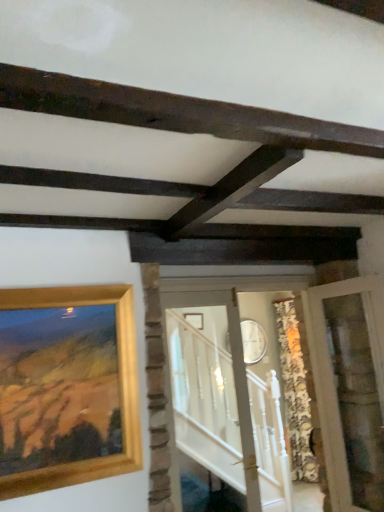
Where is `clear glass door at right, the second glass door from the left`? clear glass door at right, the second glass door from the left is located at coordinates (351, 388).

Where is `gold wooden picture frame at upper left`? gold wooden picture frame at upper left is located at coordinates (67, 387).

Is clear glass door at right, the second glass door from the left, surrounding dark brown wood at upper center?

No, dark brown wood at upper center is not a part of clear glass door at right, the second glass door from the left.

From a real-world perspective, which object stands above the other?

dark brown wood at upper center is physically above.

Looking at this image, which object is further away from the camera taking this photo, clear glass door at right, which is the first glass door from right to left, or dark brown wood at upper center?

clear glass door at right, which is the first glass door from right to left.

How many degrees apart are the facing directions of clear glass door at right, which is the first glass door from right to left, and dark brown wood at upper center?

The angular difference between clear glass door at right, which is the first glass door from right to left, and dark brown wood at upper center is 85.9 degrees.

Considering the relative positions of dark brown wood at upper center and clear glass door at right, which is the first glass door from right to left, in the image provided, is dark brown wood at upper center to the left of clear glass door at right, which is the first glass door from right to left, from the viewer's perspective?

Correct, you'll find dark brown wood at upper center to the left of clear glass door at right, which is the first glass door from right to left.

In the scene shown: From the image's perspective, which is above, dark brown wood at upper center or clear glass door at right, the second glass door from the left?

dark brown wood at upper center appears higher in the image.

Is clear glass door at right, the second glass door from the left, completely or partially inside dark brown wood at upper center?

That's incorrect, clear glass door at right, the second glass door from the left, is not inside dark brown wood at upper center.

From the image's perspective, is clear glass door at center, marked as the second glass door in a right-to-left arrangement, located beneath clear glass door at right, the second glass door from the left?

Yes, from the image's perspective, clear glass door at center, marked as the second glass door in a right-to-left arrangement, is below clear glass door at right, the second glass door from the left.

Considering the sizes of objects clear glass door at center, placed as the 1th glass door when sorted from left to right, and clear glass door at right, the second glass door from the left, in the image provided, who is thinner, clear glass door at center, placed as the 1th glass door when sorted from left to right, or clear glass door at right, the second glass door from the left,?

clear glass door at center, placed as the 1th glass door when sorted from left to right, is thinner.

Looking at this image, could you measure the distance between clear glass door at center, placed as the 1th glass door when sorted from left to right, and clear glass door at right, the second glass door from the left?

clear glass door at center, placed as the 1th glass door when sorted from left to right, and clear glass door at right, the second glass door from the left, are 1.06 meters apart.

Is clear glass door at center, placed as the 1th glass door when sorted from left to right, aimed at clear glass door at right, which is the first glass door from right to left?

No, clear glass door at center, placed as the 1th glass door when sorted from left to right, is not oriented towards clear glass door at right, which is the first glass door from right to left.

From a real-world perspective, who is located lower, clear glass door at right, which is the first glass door from right to left, or gold wooden picture frame at upper left?

From a 3D spatial view, clear glass door at right, which is the first glass door from right to left, is below.

Can you tell me how much clear glass door at right, which is the first glass door from right to left, and gold wooden picture frame at upper left differ in facing direction?

86.1 degrees separate the facing orientations of clear glass door at right, which is the first glass door from right to left, and gold wooden picture frame at upper left.

Which is farther, (376, 317) or (88, 375)?

The point (376, 317) is more distant.

Is clear glass door at right, which is the first glass door from right to left, oriented towards gold wooden picture frame at upper left?

Yes, clear glass door at right, which is the first glass door from right to left, is turned towards gold wooden picture frame at upper left.

From the image's perspective, is clear glass door at center, marked as the second glass door in a right-to-left arrangement, positioned above or below gold wooden picture frame at upper left?

clear glass door at center, marked as the second glass door in a right-to-left arrangement, is situated lower than gold wooden picture frame at upper left in the image.

In terms of height, does clear glass door at center, placed as the 1th glass door when sorted from left to right, look taller or shorter compared to gold wooden picture frame at upper left?

In the image, clear glass door at center, placed as the 1th glass door when sorted from left to right, appears to be taller than gold wooden picture frame at upper left.

In terms of size, does clear glass door at center, placed as the 1th glass door when sorted from left to right, appear bigger or smaller than gold wooden picture frame at upper left?

Considering their sizes, clear glass door at center, placed as the 1th glass door when sorted from left to right, takes up more space than gold wooden picture frame at upper left.

Is dark brown wood at upper center in contact with clear glass door at center, placed as the 1th glass door when sorted from left to right?

They are not placed beside each other.

Locate an element on the screen. Image resolution: width=384 pixels, height=512 pixels. plank above the clear glass door at center, placed as the 1th glass door when sorted from left to right (from a real-world perspective) is located at coordinates (178, 113).

In the scene shown: Which object is positioned more to the right, dark brown wood at upper center or clear glass door at center, placed as the 1th glass door when sorted from left to right?

dark brown wood at upper center.

Looking at this image, between dark brown wood at upper center and clear glass door at center, marked as the second glass door in a right-to-left arrangement, which one is positioned in front?

dark brown wood at upper center is more forward.

Which of these two, gold wooden picture frame at upper left or clear glass door at center, marked as the second glass door in a right-to-left arrangement, is wider?

clear glass door at center, marked as the second glass door in a right-to-left arrangement.

Can you tell me how much gold wooden picture frame at upper left and clear glass door at center, placed as the 1th glass door when sorted from left to right, differ in facing direction?

The facing directions of gold wooden picture frame at upper left and clear glass door at center, placed as the 1th glass door when sorted from left to right, are 0.885 degrees apart.

Identify the location of picture frame above the clear glass door at center, marked as the second glass door in a right-to-left arrangement (from the image's perspective). The image size is (384, 512). (67, 387).

Considering the points (14, 380) and (225, 505), which point is behind, point (14, 380) or point (225, 505)?

The point (225, 505) is farther from the camera.

In order to click on the 1st glass door below the dark brown wood at upper center (from the image's perspective) in this screenshot , I will do `click(351, 388)`.

Locate an element on the screen. glass door that is the 2nd object directly below the dark brown wood at upper center (from a real-world perspective) is located at coordinates (351, 388).

When comparing their distances from gold wooden picture frame at upper left, does dark brown wood at upper center or clear glass door at center, marked as the second glass door in a right-to-left arrangement, seem further?

The object further to gold wooden picture frame at upper left is clear glass door at center, marked as the second glass door in a right-to-left arrangement.

From the image, which object appears to be farther from clear glass door at right, which is the first glass door from right to left, clear glass door at center, placed as the 1th glass door when sorted from left to right, or gold wooden picture frame at upper left?

gold wooden picture frame at upper left is positioned further to the anchor clear glass door at right, which is the first glass door from right to left.

Which object lies nearer to the anchor point clear glass door at right, which is the first glass door from right to left, dark brown wood at upper center or gold wooden picture frame at upper left?

gold wooden picture frame at upper left is positioned closer to the anchor clear glass door at right, which is the first glass door from right to left.

Estimate the real-world distances between objects in this image. Which object is further from gold wooden picture frame at upper left, clear glass door at center, marked as the second glass door in a right-to-left arrangement, or dark brown wood at upper center?

clear glass door at center, marked as the second glass door in a right-to-left arrangement, is further to gold wooden picture frame at upper left.

Which object lies further to the anchor point clear glass door at center, marked as the second glass door in a right-to-left arrangement, clear glass door at right, the second glass door from the left, or gold wooden picture frame at upper left?

Among the two, gold wooden picture frame at upper left is located further to clear glass door at center, marked as the second glass door in a right-to-left arrangement.

In the scene shown: Estimate the real-world distances between objects in this image. Which object is closer to dark brown wood at upper center, clear glass door at center, marked as the second glass door in a right-to-left arrangement, or clear glass door at right, the second glass door from the left?

clear glass door at right, the second glass door from the left.

From the image, which object appears to be nearer to dark brown wood at upper center, gold wooden picture frame at upper left or clear glass door at center, placed as the 1th glass door when sorted from left to right?

gold wooden picture frame at upper left lies closer to dark brown wood at upper center than the other object.

Based on the photo, estimate the real-world distances between objects in this image. Which object is closer to clear glass door at right, which is the first glass door from right to left, clear glass door at center, placed as the 1th glass door when sorted from left to right, or dark brown wood at upper center?

clear glass door at center, placed as the 1th glass door when sorted from left to right.

Locate an element on the screen. The height and width of the screenshot is (512, 384). picture frame between dark brown wood at upper center and clear glass door at center, placed as the 1th glass door when sorted from left to right, in the up-down direction is located at coordinates (67, 387).

Locate an element on the screen. The width and height of the screenshot is (384, 512). plank between gold wooden picture frame at upper left and clear glass door at right, the second glass door from the left is located at coordinates (178, 113).

The image size is (384, 512). What are the coordinates of `glass door between dark brown wood at upper center and clear glass door at center, placed as the 1th glass door when sorted from left to right, in the vertical direction` in the screenshot? It's located at (351, 388).

I want to click on glass door between gold wooden picture frame at upper left and clear glass door at right, which is the first glass door from right to left, from left to right, so click(227, 401).